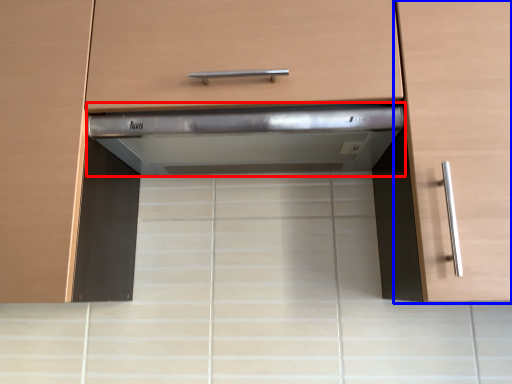
Question: Which object appears closest to the camera in this image, home appliance (highlighted by a red box) or cabinetry (highlighted by a blue box)?

Choices:
 (A) home appliance
 (B) cabinetry

Answer: (B)